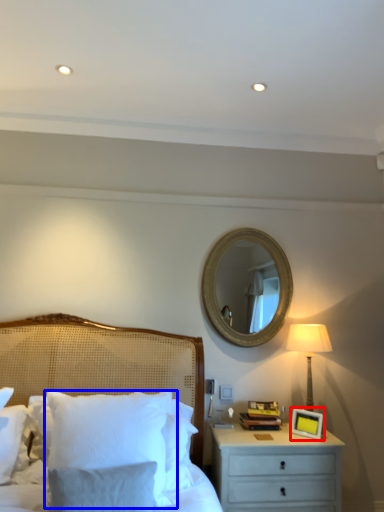
Question: Which point is closer to the camera, picture frame (highlighted by a red box) or pillow (highlighted by a blue box)?

Choices:
 (A) picture frame
 (B) pillow

Answer: (B)